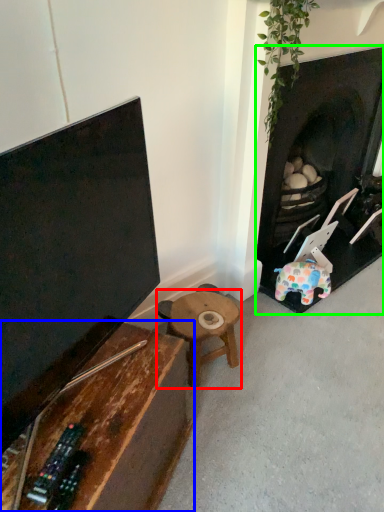
Question: Estimate the real-world distances between objects in this image. Which object is closer to table (highlighted by a red box), table (highlighted by a blue box) or fireplace (highlighted by a green box)?

Choices:
 (A) table
 (B) fireplace

Answer: (A)